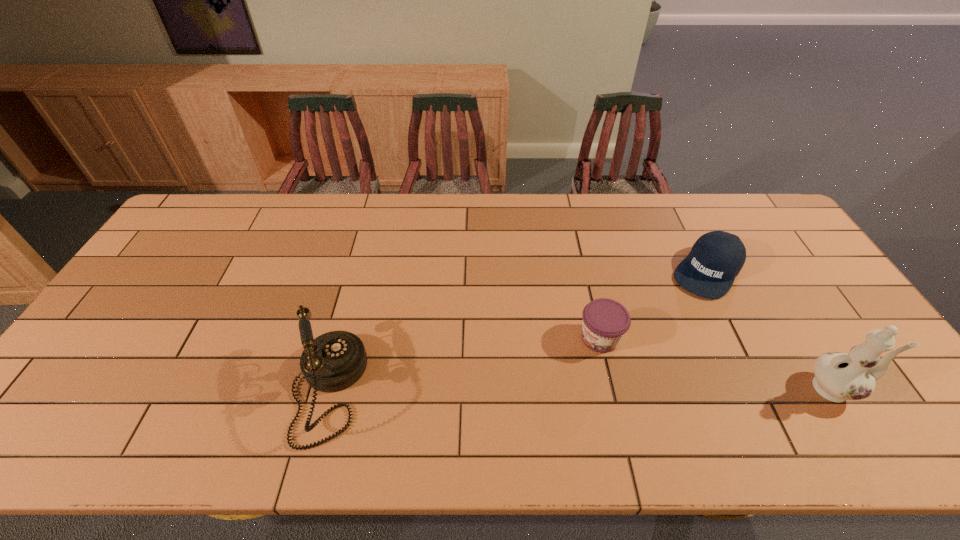
Locate an element on the screen. The width and height of the screenshot is (960, 540). vacant space on the desktop that is between the second tallest object and the tallest object and is positioned on the front-facing side of the baseball cap is located at coordinates (621, 389).

The image size is (960, 540). I want to click on vacant space on the desktop that is between the leftmost object and the chinaware and is positioned on the front label of the third object from right to left, so click(x=527, y=389).